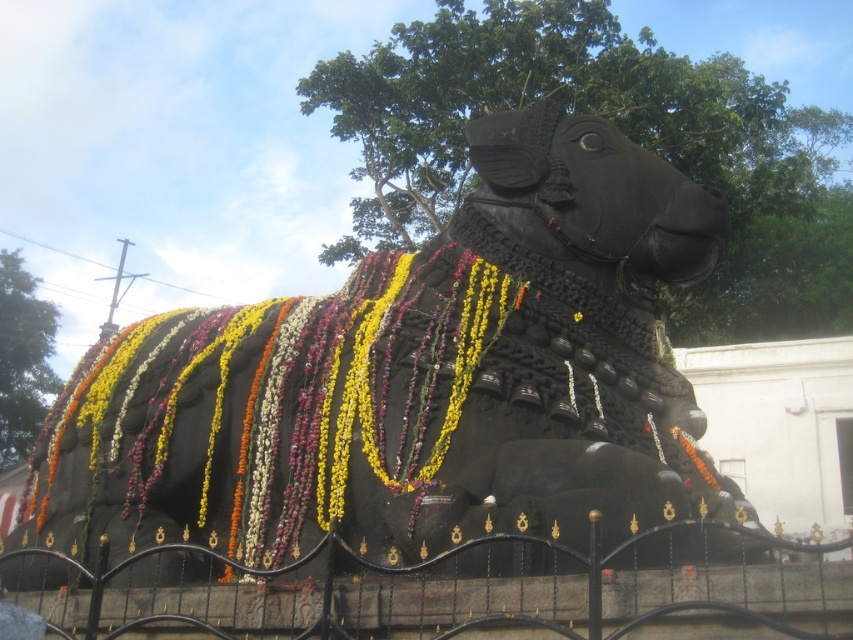
Question: Which point is closer to the camera?

Choices:
 (A) (369, 300)
 (B) (416, 424)
 (C) (548, 564)

Answer: (C)

Question: Does black polished stone bull at center appear on the right side of black wrought iron fence at center?

Choices:
 (A) yes
 (B) no

Answer: (B)

Question: Can you confirm if floral garland at center is positioned to the right of black wrought iron fence at center?

Choices:
 (A) yes
 (B) no

Answer: (B)

Question: Which object is farther from the camera taking this photo?

Choices:
 (A) black polished stone bull at center
 (B) black wrought iron fence at center
 (C) floral garland at center

Answer: (C)

Question: Does black polished stone bull at center have a smaller size compared to floral garland at center?

Choices:
 (A) no
 (B) yes

Answer: (A)

Question: Which object is positioned farthest from the black wrought iron fence at center?

Choices:
 (A) floral garland at center
 (B) black polished stone bull at center

Answer: (B)